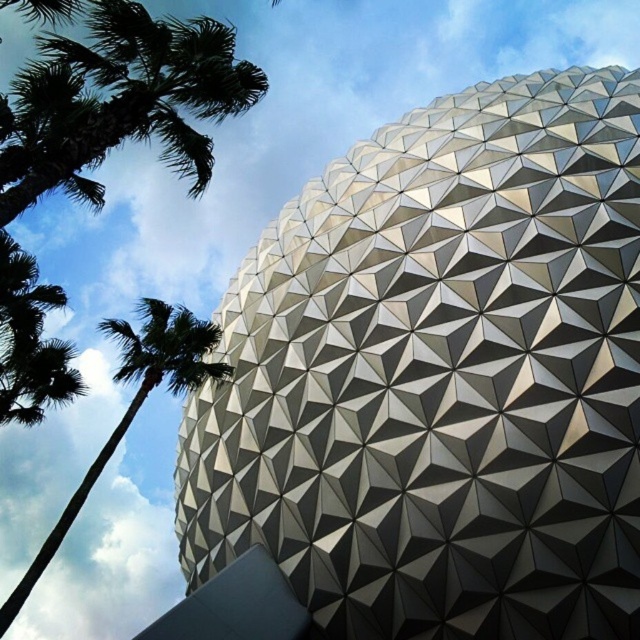
Question: Is green leafy palm tree at upper left below green leafy palm tree at left?

Choices:
 (A) no
 (B) yes

Answer: (A)

Question: Among these objects, which one is farthest from the camera?

Choices:
 (A) green leafy palm tree at left
 (B) green leafy palm tree at upper left

Answer: (A)

Question: Which point is closer to the camera?

Choices:
 (A) (161, 97)
 (B) (168, 314)

Answer: (A)

Question: Does green leafy palm tree at upper left have a greater width compared to green leafy palm tree at left?

Choices:
 (A) no
 (B) yes

Answer: (B)

Question: Does green leafy palm tree at upper left come in front of green leafy palm tree at left?

Choices:
 (A) yes
 (B) no

Answer: (A)